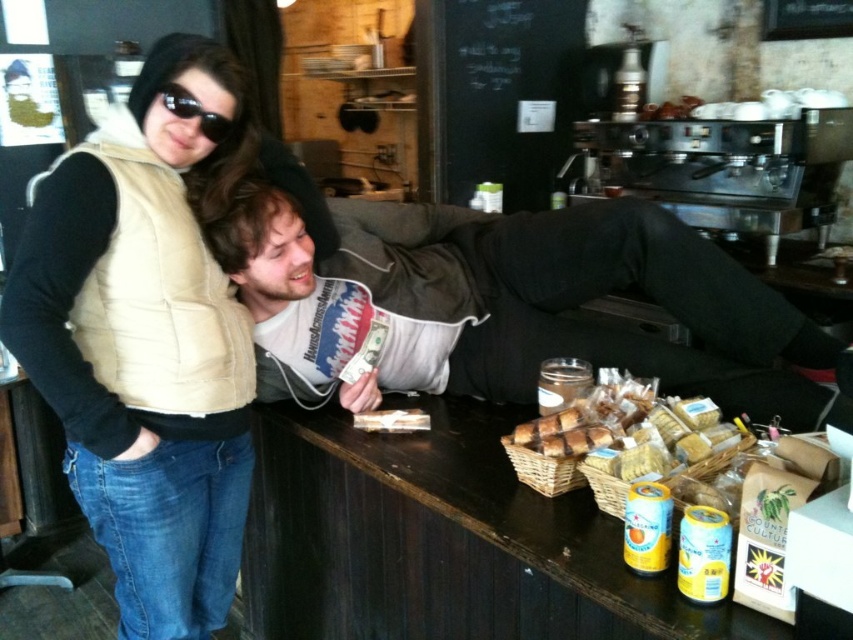
Who is more forward, [544,54] or [526,426]?

Point [526,426] is in front.

Does black chalkboard at upper center have a smaller size compared to golden brown wicker basket at center?

Actually, black chalkboard at upper center might be larger than golden brown wicker basket at center.

Is point (498, 100) less distant than point (573, 440)?

No, it is not.

Locate an element on the screen. Image resolution: width=853 pixels, height=640 pixels. black chalkboard at upper center is located at coordinates (495, 93).

Is dark brown leather jacket at center above golden brown wicker basket at center?

Indeed, dark brown leather jacket at center is positioned over golden brown wicker basket at center.

Which of these two, dark brown leather jacket at center or golden brown wicker basket at center, stands taller?

dark brown leather jacket at center

The height and width of the screenshot is (640, 853). I want to click on dark brown leather jacket at center, so click(509, 300).

Does beige quilted vest at upper left have a greater width compared to golden brown wicker basket at center?

Yes.

Measure the distance between beige quilted vest at upper left and camera.

Result: A distance of 1.21 meters exists between beige quilted vest at upper left and camera.

At what (x,y) coordinates should I click in order to perform the action: click on beige quilted vest at upper left. Please return your answer as a coordinate pair (x, y). This screenshot has height=640, width=853. Looking at the image, I should click on (148, 346).